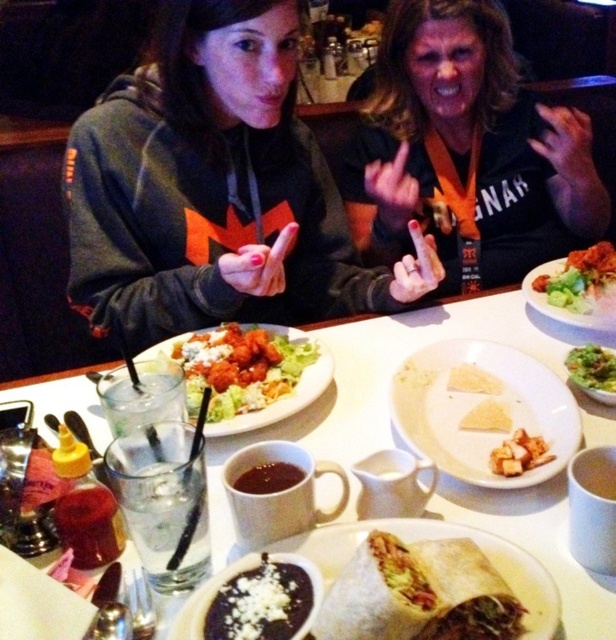
You are a photographer trying to capture a closeup of the brown crumbly bread at center and the yellow crumbly at center. Since you can only focus on one object at a time, which one should you choose to ensure it appears sharp in the photo?

The brown crumbly bread at center is closer to the viewer than the yellow crumbly at center, so focusing on the brown crumbly bread at center will ensure it appears sharp while the yellow crumbly at center may be slightly out of focus.

You are taking a photo of two friends at a table with various food items. You want to focus on the point closer to the camera. Which point should you choose between point (160, 280) and point (573, 269)?

Point (160, 280) is closer to the camera than point (573, 269), so you should choose point (160, 280) to focus on.

You are a waiter in a restaurant and you see the white matte plate at center and the yellow crumbly at center on the table. Which one is more to the left?

The white matte plate at center is more to the left because it is positioned on the left side of yellow crumbly at center.